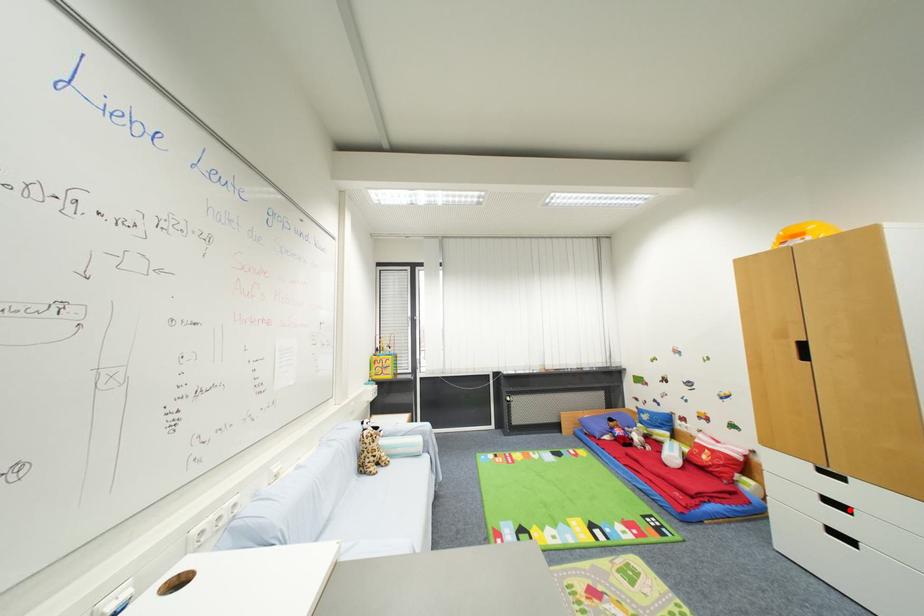
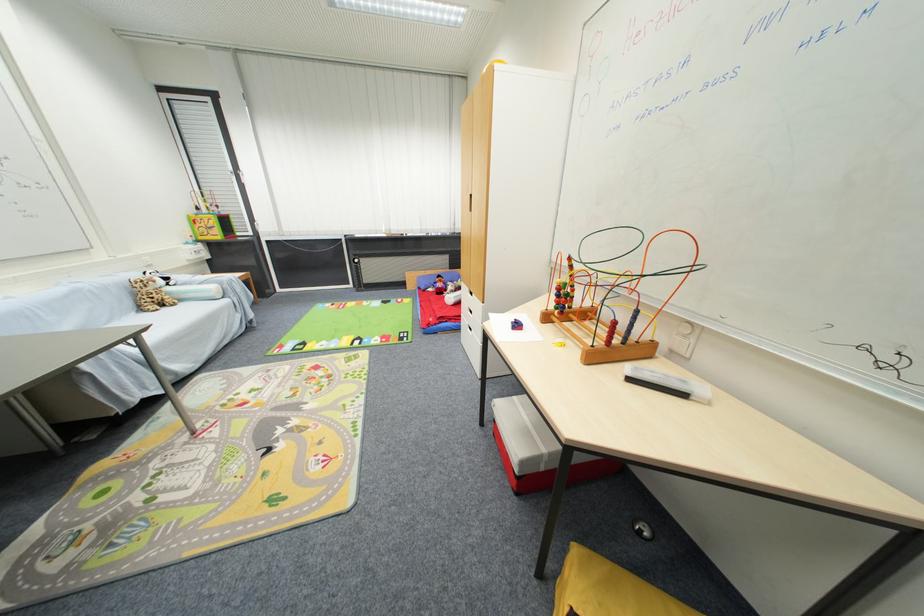
Question: I am providing you with two images of the same scene from different viewpoints. A red point is marked on the first image. Can you still see the location of the red point in image 2?

Choices:
 (A) Yes
 (B) No

Answer: (B)